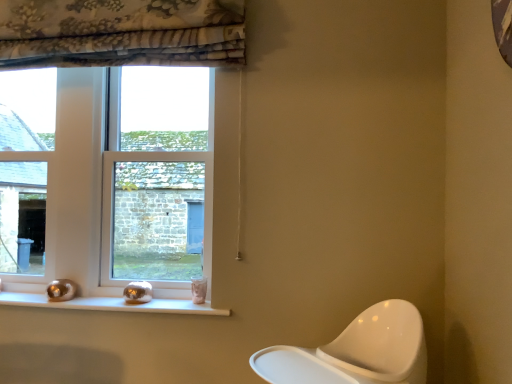
Where is `clear glass window at left, the second window when ordered from right to left`? clear glass window at left, the second window when ordered from right to left is located at coordinates 25,167.

I want to click on clear glass window at left, which is the 1th window from left to right, so click(25, 167).

Based on their sizes in the image, would you say clear glass window at center, which is the first window in right-to-left order, is bigger or smaller than clear glass window at left, the second window when ordered from right to left?

clear glass window at center, which is the first window in right-to-left order, is bigger than clear glass window at left, the second window when ordered from right to left.

Is clear glass window at center, which is the first window in right-to-left order, inside the boundaries of clear glass window at left, which is the 1th window from left to right, or outside?

clear glass window at center, which is the first window in right-to-left order, exists outside the volume of clear glass window at left, which is the 1th window from left to right.

In the scene shown: Which object is further away from the camera taking this photo, clear glass window at center, which is the first window in right-to-left order, or clear glass window at left, the second window when ordered from right to left?

clear glass window at left, the second window when ordered from right to left.

How many degrees apart are the facing directions of clear glass window at center, the second window positioned from the left, and clear glass window at left, which is the 1th window from left to right?

0.143 degrees.

Could you tell me if white glossy window sill at lower center is turned towards clear glass window at center, which is the first window in right-to-left order?

No, white glossy window sill at lower center is not oriented towards clear glass window at center, which is the first window in right-to-left order.

Consider the image. From the image's perspective, relative to clear glass window at center, which is the first window in right-to-left order, is white glossy window sill at lower center above or below?

Clearly, from the image's perspective, white glossy window sill at lower center is below clear glass window at center, which is the first window in right-to-left order.

Is point (124, 301) farther from camera compared to point (201, 130)?

No, (124, 301) is in front of (201, 130).

Which of these two, white glossy window sill at lower center or clear glass window at center, which is the first window in right-to-left order, stands taller?

clear glass window at center, which is the first window in right-to-left order.

Does clear glass window at center, the second window positioned from the left, have a larger size compared to white glossy window sill at lower center?

Indeed, clear glass window at center, the second window positioned from the left, has a larger size compared to white glossy window sill at lower center.

Is clear glass window at center, which is the first window in right-to-left order, inside the boundaries of white glossy window sill at lower center, or outside?

clear glass window at center, which is the first window in right-to-left order, cannot be found inside white glossy window sill at lower center.

From the image's perspective, is clear glass window at center, which is the first window in right-to-left order, positioned above or below white glossy window sill at lower center?

clear glass window at center, which is the first window in right-to-left order, is situated higher than white glossy window sill at lower center in the image.

In order to click on window sill lying below the clear glass window at left, the second window when ordered from right to left (from the image's perspective) in this screenshot , I will do `click(112, 304)`.

Does clear glass window at left, the second window when ordered from right to left, appear on the right side of white glossy window sill at lower center?

No, clear glass window at left, the second window when ordered from right to left, is not to the right of white glossy window sill at lower center.

From the image's perspective, which object appears higher, clear glass window at left, the second window when ordered from right to left, or white glossy window sill at lower center?

clear glass window at left, the second window when ordered from right to left, from the image's perspective.

Which object is positioned more to the right, white glossy window sill at lower center or clear glass window at left, the second window when ordered from right to left?

white glossy window sill at lower center.

Where is `window sill located underneath the clear glass window at left, which is the 1th window from left to right (from a real-world perspective)`? window sill located underneath the clear glass window at left, which is the 1th window from left to right (from a real-world perspective) is located at coordinates point(112,304).

Is white glossy window sill at lower center directly adjacent to clear glass window at left, which is the 1th window from left to right?

No, white glossy window sill at lower center is not beside clear glass window at left, which is the 1th window from left to right.

What's the angular difference between white glossy window sill at lower center and clear glass window at left, which is the 1th window from left to right,'s facing directions?

They differ by 2.48 degrees in their facing directions.

In the scene shown: Is clear glass window at left, the second window when ordered from right to left, facing towards clear glass window at center, the second window positioned from the left?

No, clear glass window at left, the second window when ordered from right to left, is not turned towards clear glass window at center, the second window positioned from the left.

Between clear glass window at left, the second window when ordered from right to left, and clear glass window at center, which is the first window in right-to-left order, which one appears on the left side from the viewer's perspective?

Positioned to the left is clear glass window at left, the second window when ordered from right to left.

In terms of height, does clear glass window at left, the second window when ordered from right to left, look taller or shorter compared to clear glass window at center, the second window positioned from the left?

clear glass window at left, the second window when ordered from right to left, is taller than clear glass window at center, the second window positioned from the left.

Find the location of a particular element. The height and width of the screenshot is (384, 512). window on the left of the clear glass window at center, the second window positioned from the left is located at coordinates (25, 167).

I want to click on window on the right of the white glossy window sill at lower center, so click(x=159, y=177).

Estimate the real-world distances between objects in this image. Which object is closer to clear glass window at center, the second window positioned from the left, clear glass window at left, which is the 1th window from left to right, or white glossy window sill at lower center?

clear glass window at left, which is the 1th window from left to right.

Looking at the image, which one is located closer to clear glass window at left, the second window when ordered from right to left, clear glass window at center, which is the first window in right-to-left order, or white glossy window sill at lower center?

The object closer to clear glass window at left, the second window when ordered from right to left, is clear glass window at center, which is the first window in right-to-left order.

Looking at the image, which one is located further to clear glass window at center, which is the first window in right-to-left order, white glossy window sill at lower center or clear glass window at left, the second window when ordered from right to left?

white glossy window sill at lower center.

Looking at the image, which one is located closer to clear glass window at left, which is the 1th window from left to right, white glossy window sill at lower center or clear glass window at center, the second window positioned from the left?

Based on the image, clear glass window at center, the second window positioned from the left, appears to be nearer to clear glass window at left, which is the 1th window from left to right.

Which object lies nearer to the anchor point white glossy window sill at lower center, clear glass window at left, the second window when ordered from right to left, or clear glass window at center, which is the first window in right-to-left order?

Based on the image, clear glass window at center, which is the first window in right-to-left order, appears to be nearer to white glossy window sill at lower center.

Looking at the image, which one is located closer to white glossy window sill at lower center, clear glass window at center, which is the first window in right-to-left order, or clear glass window at left, which is the 1th window from left to right?

The object closer to white glossy window sill at lower center is clear glass window at center, which is the first window in right-to-left order.

The height and width of the screenshot is (384, 512). I want to click on window sill situated between clear glass window at left, the second window when ordered from right to left, and clear glass window at center, which is the first window in right-to-left order, from left to right, so click(x=112, y=304).